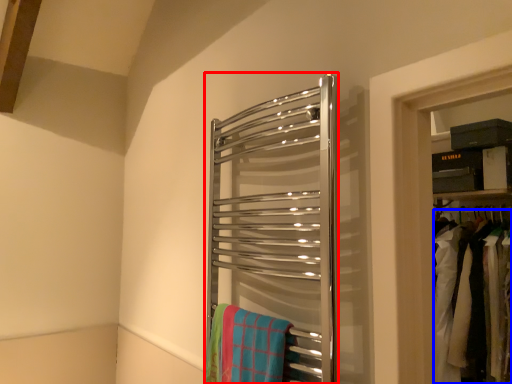
Question: Which object is further to the camera taking this photo, towel rack (highlighted by a red box) or laundry (highlighted by a blue box)?

Choices:
 (A) towel rack
 (B) laundry

Answer: (B)